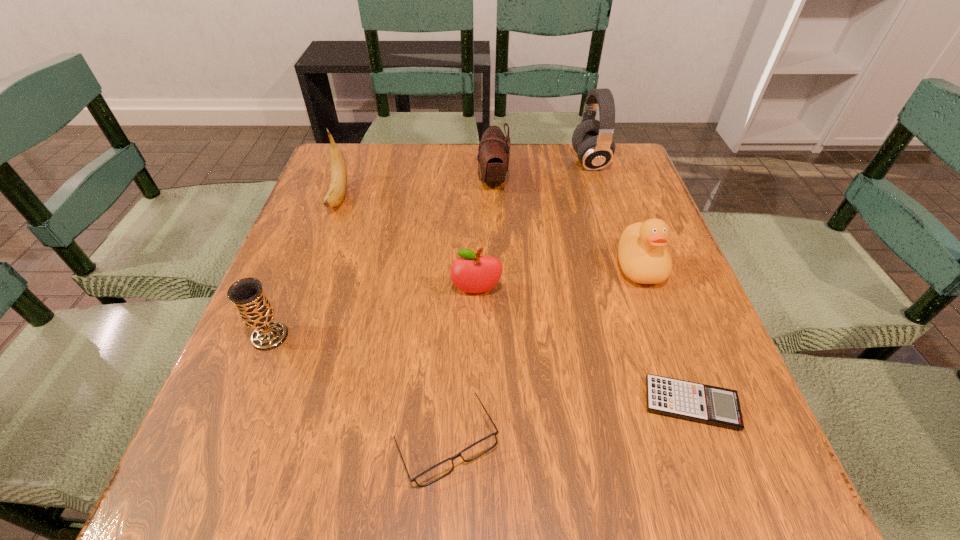
At what (x,y) coordinates should I click in order to perform the action: click on vacant space located on the ear cups of the headset. Please return your answer as a coordinate pair (x, y). This screenshot has width=960, height=540. Looking at the image, I should click on point(495,161).

Where is `vacant space located 0.120m at the start of the peel on the banana`? This screenshot has height=540, width=960. vacant space located 0.120m at the start of the peel on the banana is located at coordinates (319, 252).

At what (x,y) coordinates should I click in order to perform the action: click on free space located with the flap open on the pouch. Please return your answer as a coordinate pair (x, y). The height and width of the screenshot is (540, 960). Looking at the image, I should click on (378, 179).

Identify the location of vacant space located with the flap open on the pouch. (454, 179).

Locate an element on the screen. This screenshot has height=540, width=960. vacant space located with the flap open on the pouch is located at coordinates (397, 179).

The width and height of the screenshot is (960, 540). Identify the location of free space located on the face of the duck. (666, 340).

Image resolution: width=960 pixels, height=540 pixels. I want to click on vacant space located 0.190m on the front of the chalice, so click(221, 458).

You are a GUI agent. You are given a task and a screenshot of the screen. Output one action in this format:
    pyautogui.click(x=<x>, y=<y>)
    Task: Click on the free space located on the back of the apple
    Image resolution: width=960 pixels, height=540 pixels.
    Given the screenshot: What is the action you would take?
    point(477,197)

Identify the location of free space located on the back of the shortest object. (653, 298).

The width and height of the screenshot is (960, 540). Identify the location of headset at the far edge. (592, 140).